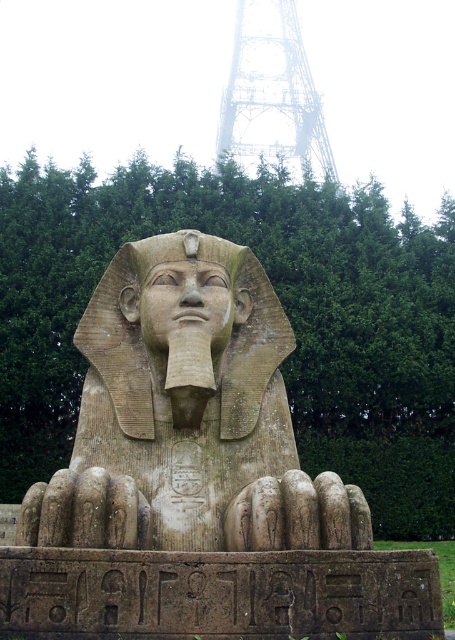
You are standing in front of the sphinx statue and want to take a photo. Your camera has a maximum focus range of 15 meters. Can you focus on the stone statue at center with your camera?

The stone statue at center is 16.92 meters away from the viewer, which exceeds the camera maximum focus range of 15 meters. Therefore, you cannot focus on the stone statue at center with your camera.

You are an archaeologist examining the sphinx statue. You notice the metallic lattice structure at upper center and the matte stone nose at center. Which object is positioned higher up on the statue?

The metallic lattice structure at upper center is located above the matte stone nose at center, so it is positioned higher up on the statue.